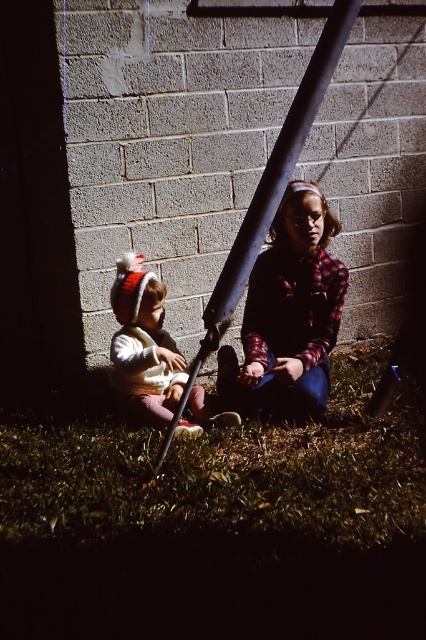
Question: Does green grass at lower center have a larger size compared to plaid shirt at center?

Choices:
 (A) no
 (B) yes

Answer: (B)

Question: From the image, what is the correct spatial relationship of plaid shirt at center in relation to white woolen hat at left?

Choices:
 (A) left
 (B) right

Answer: (B)

Question: Can you confirm if metallic pole at center is smaller than white woolen hat at left?

Choices:
 (A) no
 (B) yes

Answer: (A)

Question: Which of the following is the farthest from the observer?

Choices:
 (A) (359, 500)
 (B) (172, 424)

Answer: (B)

Question: Which point is farther to the camera?

Choices:
 (A) white woolen hat at left
 (B) metallic pole at center
 (C) plaid shirt at center

Answer: (A)

Question: Which of the following is the closest to the observer?

Choices:
 (A) (294, 323)
 (B) (152, 337)
 (C) (121, 470)

Answer: (C)